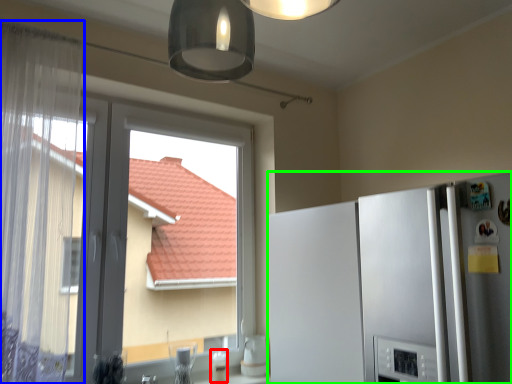
Question: Which object is positioned farthest from appliance (highlighted by a red box)? Select from curtain (highlighted by a blue box) and refrigerator (highlighted by a green box).

Choices:
 (A) curtain
 (B) refrigerator

Answer: (A)